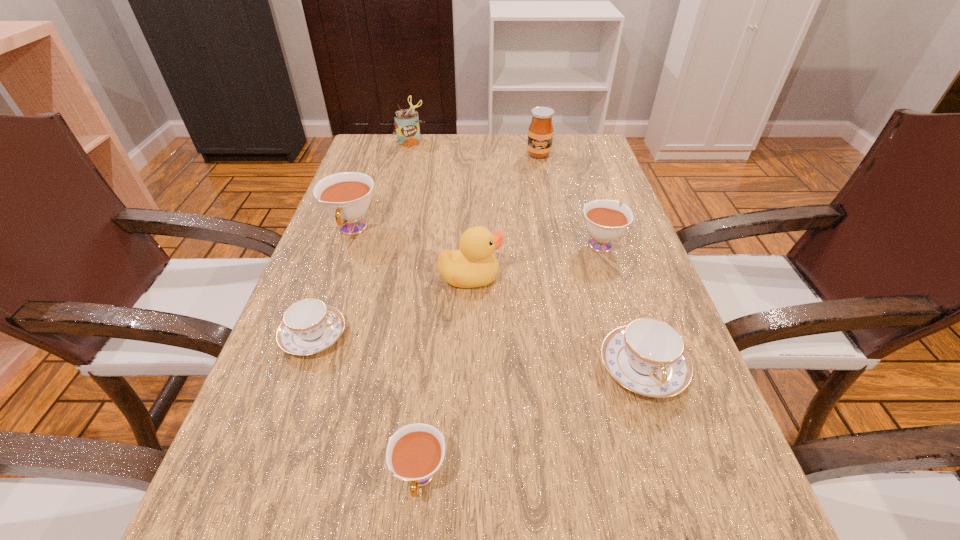
This screenshot has height=540, width=960. Identify the location of vacant position at the far left corner of the desktop. (389, 158).

In the image, there is a desktop. Where is `free space at the far right corner`? free space at the far right corner is located at coordinates (577, 160).

What are the coordinates of `blank region between the second farthest object and the second smallest white teacup` in the screenshot? It's located at (569, 199).

This screenshot has height=540, width=960. Find the location of `vacant area that lies between the yellow duck and the biggest white teacup`. vacant area that lies between the yellow duck and the biggest white teacup is located at coordinates 412,253.

What are the coordinates of `vacant point located between the fourth nearest object and the smaller blue teacup` in the screenshot? It's located at (393, 307).

The width and height of the screenshot is (960, 540). I want to click on free space between the rightmost white teacup and the left blue teacup, so click(x=457, y=289).

Locate an element on the screen. The width and height of the screenshot is (960, 540). free space between the duck and the smaller blue teacup is located at coordinates (393, 307).

The height and width of the screenshot is (540, 960). Find the location of `vacant area between the left blue teacup and the bigger blue teacup`. vacant area between the left blue teacup and the bigger blue teacup is located at coordinates (478, 352).

You are a GUI agent. You are given a task and a screenshot of the screen. Output one action in this format:
    pyautogui.click(x=<x>, y=<y>)
    Task: Click on the blank region between the nearest object and the duck
    The image size is (960, 540).
    Given the screenshot: What is the action you would take?
    pyautogui.click(x=445, y=377)

What are the coordinates of `empty space that is in between the biggest white teacup and the nearest object` in the screenshot? It's located at (386, 353).